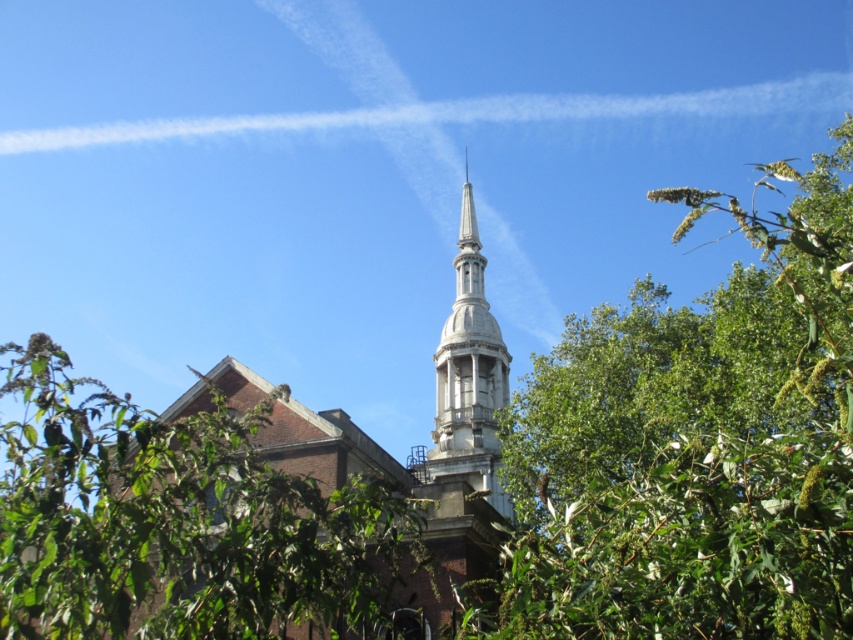
You are standing in front of the building with the spire and want to take a photo of the spire without any obstructions. The green leafy tree at center is blocking your view. What should you do to avoid the obstruction?

Move to the left or right of the green leafy tree at center to get an unobstructed view of the spire.

You are standing in front of the building with the spire and want to take a photo of the spire without any obstructions. There is a green leafy tree at upper center in the way. Can you estimate the coordinates where you should position yourself to avoid the tree?

The green leafy tree at upper center is located at coordinates point (x=694, y=445). To avoid the tree, position yourself to the left or right of these coordinates, or adjust your angle so that the tree is not in the frame.

You are standing in front of the building and want to take a photo of the stone spire at center without the green leafy tree at center blocking it. Which direction should you move to ensure the tree is out of the frame?

Move to the right side of the stone spire at center so that the green leafy tree at center, which is on the left of the spire, will be out of the frame.